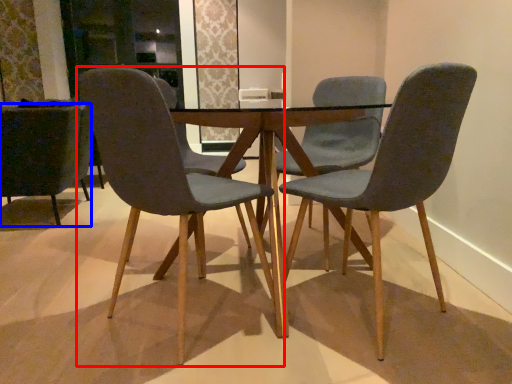
Question: Which point is closer to the camera, chair (highlighted by a red box) or chair (highlighted by a blue box)?

Choices:
 (A) chair
 (B) chair

Answer: (A)